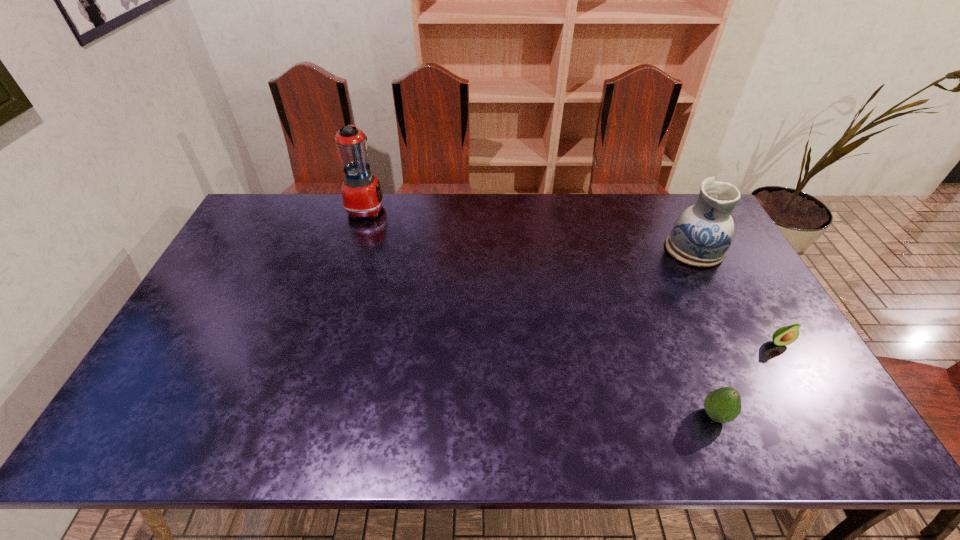
Where is `the tallest object`? This screenshot has width=960, height=540. the tallest object is located at coordinates (362, 195).

Where is `food processor`? This screenshot has width=960, height=540. food processor is located at coordinates (362, 195).

You are a GUI agent. You are given a task and a screenshot of the screen. Output one action in this format:
    pyautogui.click(x=<x>, y=<y>)
    Task: Click on the second tallest object
    Image resolution: width=960 pixels, height=540 pixels.
    Given the screenshot: What is the action you would take?
    pyautogui.click(x=701, y=235)

Where is `pottery`? The height and width of the screenshot is (540, 960). pottery is located at coordinates (701, 235).

What are the coordinates of `the left avocado` in the screenshot? It's located at (722, 405).

Locate an element on the screen. the taller avocado is located at coordinates (722, 405).

This screenshot has width=960, height=540. I want to click on the farther avocado, so click(x=786, y=335).

What are the coordinates of `the second nearest object` in the screenshot? It's located at (786, 335).

Find the location of `vacant space positioned on the controls of the tallest object`. vacant space positioned on the controls of the tallest object is located at coordinates (487, 208).

Where is `vacant space located 0.100m on the front of the third nearest object`? The height and width of the screenshot is (540, 960). vacant space located 0.100m on the front of the third nearest object is located at coordinates (x=716, y=292).